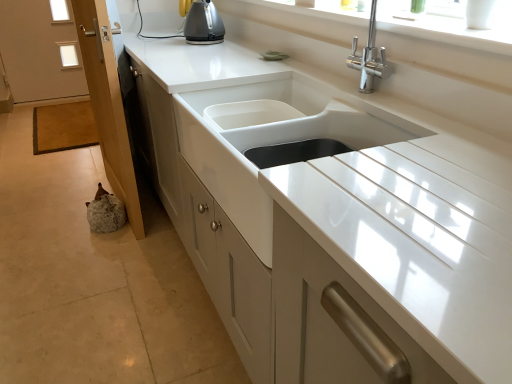
Question: Should I look upward or downward to see wooden screen door at lower left?

Choices:
 (A) down
 (B) up

Answer: (B)

Question: Is white glossy sink at center positioned beyond the bounds of wooden screen door at lower left?

Choices:
 (A) yes
 (B) no

Answer: (A)

Question: Does white glossy sink at center come behind wooden screen door at lower left?

Choices:
 (A) yes
 (B) no

Answer: (B)

Question: Is white glossy sink at center wider than wooden screen door at lower left?

Choices:
 (A) yes
 (B) no

Answer: (A)

Question: From the image's perspective, is white glossy sink at center beneath wooden screen door at lower left?

Choices:
 (A) yes
 (B) no

Answer: (A)

Question: Considering the relative sizes of white glossy sink at center and wooden screen door at lower left in the image provided, is white glossy sink at center bigger than wooden screen door at lower left?

Choices:
 (A) no
 (B) yes

Answer: (A)

Question: Is the surface of white glossy sink at center in direct contact with wooden screen door at lower left?

Choices:
 (A) no
 (B) yes

Answer: (A)

Question: From the image's perspective, is wooden screen door at lower left under white glossy sink at center?

Choices:
 (A) yes
 (B) no

Answer: (B)

Question: Is wooden screen door at lower left positioned with its back to white glossy sink at center?

Choices:
 (A) yes
 (B) no

Answer: (B)

Question: Is wooden screen door at lower left closer to the viewer compared to white glossy sink at center?

Choices:
 (A) no
 (B) yes

Answer: (A)

Question: Is wooden screen door at lower left shorter than white glossy sink at center?

Choices:
 (A) yes
 (B) no

Answer: (B)

Question: Is there a large distance between wooden screen door at lower left and white glossy sink at center?

Choices:
 (A) no
 (B) yes

Answer: (A)

Question: Does wooden screen door at lower left have a greater width compared to white glossy sink at center?

Choices:
 (A) yes
 (B) no

Answer: (B)

Question: From their relative heights in the image, would you say wooden screen door at lower left is taller or shorter than white glossy sink at center?

Choices:
 (A) short
 (B) tall

Answer: (B)